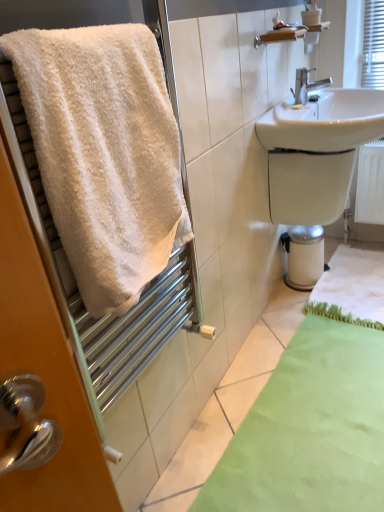
Question: Looking at the image, does green fuzzy bath mat at lower right, which ranks as the 2th bath mat in front-to-back order, seem bigger or smaller compared to silver metallic faucet at upper right?

Choices:
 (A) small
 (B) big

Answer: (B)

Question: Looking at their shapes, would you say green fuzzy bath mat at lower right, which ranks as the 2th bath mat in front-to-back order, is wider or thinner than silver metallic faucet at upper right?

Choices:
 (A) thin
 (B) wide

Answer: (B)

Question: Which is farther from the white glossy bidet at lower right?

Choices:
 (A) white fluffy towel at left
 (B) silver metallic faucet at upper right
 (C) green fabric bath mat at lower center, placed as the 1th bath mat when sorted from front to back
 (D) green fuzzy bath mat at lower right, which ranks as the 2th bath mat in front-to-back order
 (E) white glossy sink at upper right

Answer: (A)

Question: Which object is positioned closest to the green fuzzy bath mat at lower right, which ranks as the 2th bath mat in front-to-back order?

Choices:
 (A) silver metallic faucet at upper right
 (B) white glossy sink at upper right
 (C) white fluffy towel at left
 (D) green fabric bath mat at lower center, placed as the 1th bath mat when sorted from front to back
 (E) white glossy bidet at lower right

Answer: (E)